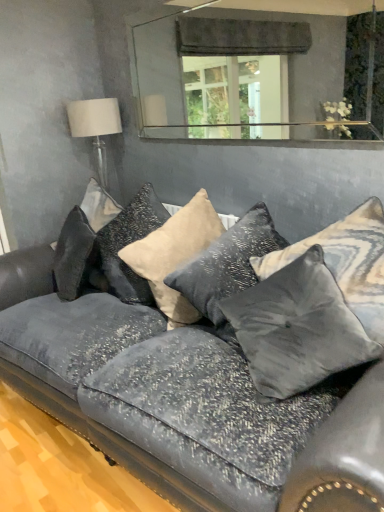
You are a GUI agent. You are given a task and a screenshot of the screen. Output one action in this format:
    pyautogui.click(x=<x>, y=<y>)
    Task: Click on the velvet couch at center
    
    Given the screenshot: What is the action you would take?
    pyautogui.click(x=184, y=402)

Image resolution: width=384 pixels, height=512 pixels. In order to click on velvet gray pillow at center, arranged as the 2th pillow when viewed from the right in this screenshot , I will do `click(298, 328)`.

From a real-world perspective, relative to satin beige pillow at center, arranged as the second pillow when viewed from the left, is satin gray pillow at center, which is the fifth pillow in left-to-right order, vertically above or below?

From a real-world perspective, satin gray pillow at center, which is the fifth pillow in left-to-right order, is physically above satin beige pillow at center, arranged as the second pillow when viewed from the left.

Which is more to the left, satin gray pillow at center, marked as the 1th pillow in a right-to-left arrangement, or satin beige pillow at center, the 4th pillow in the right-to-left sequence?

Positioned to the left is satin beige pillow at center, the 4th pillow in the right-to-left sequence.

This screenshot has width=384, height=512. What are the coordinates of `the 1st pillow below the satin beige pillow at center, the 4th pillow in the right-to-left sequence (from the image's perspective)` in the screenshot? It's located at (346, 262).

How many degrees apart are the facing directions of satin gray pillow at center, which is the fifth pillow in left-to-right order, and satin beige pillow at center, arranged as the second pillow when viewed from the left?

The facing directions of satin gray pillow at center, which is the fifth pillow in left-to-right order, and satin beige pillow at center, arranged as the second pillow when viewed from the left, are 0.000754 degrees apart.

Is velvet couch at center surrounding satin gray pillow at center, which is the fifth pillow in left-to-right order?

Indeed, satin gray pillow at center, which is the fifth pillow in left-to-right order, is located within velvet couch at center.

From a real-world perspective, between velvet couch at center and satin gray pillow at center, marked as the 1th pillow in a right-to-left arrangement, who is vertically lower?

velvet couch at center is physically lower.

In the image, there is a satin gray pillow at center, marked as the 1th pillow in a right-to-left arrangement. In order to click on studio couch below it (from the image's perspective) in this screenshot , I will do `click(184, 402)`.

From the image's perspective, is velvet couch at center above or below satin gray pillow at center, marked as the 1th pillow in a right-to-left arrangement?

Clearly, from the image's perspective, velvet couch at center is below satin gray pillow at center, marked as the 1th pillow in a right-to-left arrangement.

Looking at this image, is clear glass mirror at upper center in front of or behind velvet beige pillow at center, arranged as the fifth pillow when viewed from the right, in the image?

clear glass mirror at upper center is positioned closer to the viewer than velvet beige pillow at center, arranged as the fifth pillow when viewed from the right.

Can you confirm if clear glass mirror at upper center is taller than velvet beige pillow at center, acting as the first pillow starting from the left?

Indeed, clear glass mirror at upper center has a greater height compared to velvet beige pillow at center, acting as the first pillow starting from the left.

Is point (343, 24) less distant than point (130, 206)?

No, (343, 24) is behind (130, 206).

Is clear glass mirror at upper center not near velvet beige pillow at center, arranged as the fifth pillow when viewed from the right?

clear glass mirror at upper center is far away from velvet beige pillow at center, arranged as the fifth pillow when viewed from the right.

Can white fabric lampshade at upper left be found inside clear glass mirror at upper center?

Definitely not — white fabric lampshade at upper left is not inside clear glass mirror at upper center.

Does point (317, 127) lie behind point (71, 123)?

That is True.

From the image's perspective, which is below, clear glass mirror at upper center or white fabric lampshade at upper left?

From the image's view, white fabric lampshade at upper left is below.

Which is more to the right, satin beige pillow at center, arranged as the second pillow when viewed from the left, or velvet beige pillow at center, arranged as the fifth pillow when viewed from the right?

satin beige pillow at center, arranged as the second pillow when viewed from the left, is more to the right.

Is satin beige pillow at center, arranged as the second pillow when viewed from the left, not within velvet beige pillow at center, arranged as the fifth pillow when viewed from the right?

No.

From their relative heights in the image, would you say satin beige pillow at center, arranged as the second pillow when viewed from the left, is taller or shorter than velvet beige pillow at center, acting as the first pillow starting from the left?

Considering their sizes, satin beige pillow at center, arranged as the second pillow when viewed from the left, has more height than velvet beige pillow at center, acting as the first pillow starting from the left.

Between satin beige pillow at center, arranged as the second pillow when viewed from the left, and velvet beige pillow at center, acting as the first pillow starting from the left, which one is positioned behind?

velvet beige pillow at center, acting as the first pillow starting from the left, is behind.

Is clear glass mirror at upper center to the right of velvet gray pillow at center, arranged as the 2th pillow when viewed from the right, from the viewer's perspective?

Incorrect, clear glass mirror at upper center is not on the right side of velvet gray pillow at center, arranged as the 2th pillow when viewed from the right.

From the image's perspective, between clear glass mirror at upper center and velvet gray pillow at center, arranged as the 2th pillow when viewed from the right, who is located below?

velvet gray pillow at center, arranged as the 2th pillow when viewed from the right, is shown below in the image.

From a real-world perspective, between clear glass mirror at upper center and velvet gray pillow at center, acting as the fourth pillow starting from the left, who is vertically higher?

From a 3D spatial view, clear glass mirror at upper center is above.

How far apart are clear glass mirror at upper center and velvet gray pillow at center, acting as the fourth pillow starting from the left?

clear glass mirror at upper center and velvet gray pillow at center, acting as the fourth pillow starting from the left, are 9.17 feet apart from each other.

Looking at this image, is satin gray pillow at center, the 3th pillow when ordered from left to right, positioned beyond the bounds of satin gray pillow at center, which is the fifth pillow in left-to-right order?

Absolutely, satin gray pillow at center, the 3th pillow when ordered from left to right, is external to satin gray pillow at center, which is the fifth pillow in left-to-right order.

Which object is closer to the camera taking this photo, satin gray pillow at center, the 3th pillow when ordered from left to right, or satin gray pillow at center, which is the fifth pillow in left-to-right order?

satin gray pillow at center, which is the fifth pillow in left-to-right order, is closer to the camera.

Which of these two, satin gray pillow at center, the 3th pillow when ordered from left to right, or satin gray pillow at center, which is the fifth pillow in left-to-right order, is smaller?

With smaller size is satin gray pillow at center, which is the fifth pillow in left-to-right order.

From the picture: Which is closer to the camera, (172, 282) or (341, 257)?

The point (341, 257) is closer to the camera.

From the satin gray pillow at center, which is the fifth pillow in left-to-right order, count 2nd pillows backward and point to it. Please provide its 2D coordinates.

[(174, 255)]

From a real-world perspective, count 5th pillows upward from the velvet couch at center and point to it. Please provide its 2D coordinates.

[(346, 262)]

Which object lies further to the anchor point clear glass mirror at upper center, velvet gray pillow at center, acting as the fourth pillow starting from the left, or velvet beige pillow at center, acting as the first pillow starting from the left?

Based on the image, velvet gray pillow at center, acting as the fourth pillow starting from the left, appears to be further to clear glass mirror at upper center.

Based on their spatial positions, is velvet couch at center or satin gray pillow at center, the 3th pillow when ordered from left to right, closer to clear glass mirror at upper center?

The object closer to clear glass mirror at upper center is satin gray pillow at center, the 3th pillow when ordered from left to right.

When comparing their distances from satin beige pillow at center, the 4th pillow in the right-to-left sequence, does velvet beige pillow at center, arranged as the fifth pillow when viewed from the right, or velvet couch at center seem closer?

The object closer to satin beige pillow at center, the 4th pillow in the right-to-left sequence, is velvet beige pillow at center, arranged as the fifth pillow when viewed from the right.

Which object lies further to the anchor point velvet beige pillow at center, arranged as the fifth pillow when viewed from the right, velvet gray pillow at center, acting as the fourth pillow starting from the left, or satin beige pillow at center, arranged as the second pillow when viewed from the left?

velvet gray pillow at center, acting as the fourth pillow starting from the left, is positioned further to the anchor velvet beige pillow at center, arranged as the fifth pillow when viewed from the right.

Based on their spatial positions, is satin beige pillow at center, arranged as the second pillow when viewed from the left, or clear glass mirror at upper center closer to white fabric lampshade at upper left?

satin beige pillow at center, arranged as the second pillow when viewed from the left, lies closer to white fabric lampshade at upper left than the other object.

Estimate the real-world distances between objects in this image. Which object is closer to satin gray pillow at center, which is counted as the 3th pillow, starting from the right, clear glass mirror at upper center or satin gray pillow at center, which is the fifth pillow in left-to-right order?

satin gray pillow at center, which is the fifth pillow in left-to-right order.

In the scene shown: When comparing their distances from satin gray pillow at center, which is the fifth pillow in left-to-right order, does velvet gray pillow at center, arranged as the 2th pillow when viewed from the right, or velvet couch at center seem further?

velvet couch at center.

Estimate the real-world distances between objects in this image. Which object is closer to satin gray pillow at center, the 3th pillow when ordered from left to right, satin gray pillow at center, which is the fifth pillow in left-to-right order, or white fabric lampshade at upper left?

satin gray pillow at center, which is the fifth pillow in left-to-right order, is closer to satin gray pillow at center, the 3th pillow when ordered from left to right.

This screenshot has width=384, height=512. I want to click on pillow positioned between velvet gray pillow at center, acting as the fourth pillow starting from the left, and satin gray pillow at center, the 3th pillow when ordered from left to right, from near to far, so click(x=346, y=262).

Locate an element on the screen. pillow positioned between satin gray pillow at center, which is counted as the 3th pillow, starting from the right, and velvet beige pillow at center, acting as the first pillow starting from the left, from near to far is located at coordinates (174, 255).

Find the location of a particular element. Image resolution: width=384 pixels, height=512 pixels. mirror between satin gray pillow at center, which is the fifth pillow in left-to-right order, and white fabric lampshade at upper left, along the z-axis is located at coordinates (244, 74).

The image size is (384, 512). In order to click on mirror located between satin gray pillow at center, which is counted as the 3th pillow, starting from the right, and white fabric lampshade at upper left in the depth direction in this screenshot , I will do `click(244, 74)`.